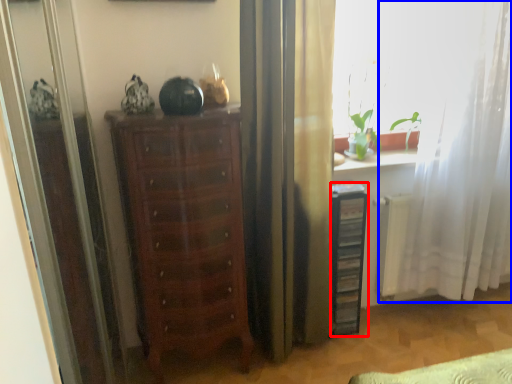
Question: Among these objects, which one is nearest to the camera, file cabinet (highlighted by a red box) or curtain (highlighted by a blue box)?

Choices:
 (A) file cabinet
 (B) curtain

Answer: (B)